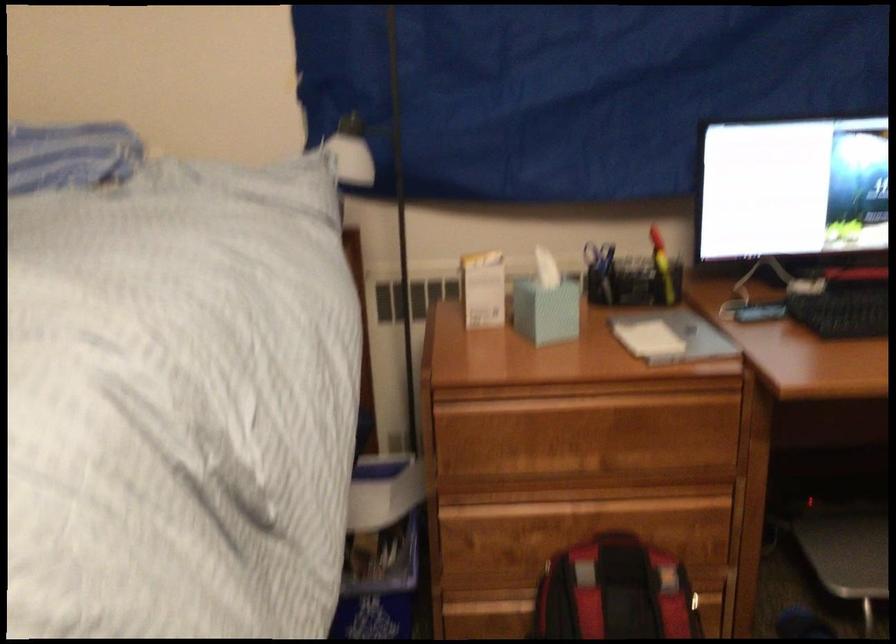
Find the location of `black handle scissors`. black handle scissors is located at coordinates (599, 272).